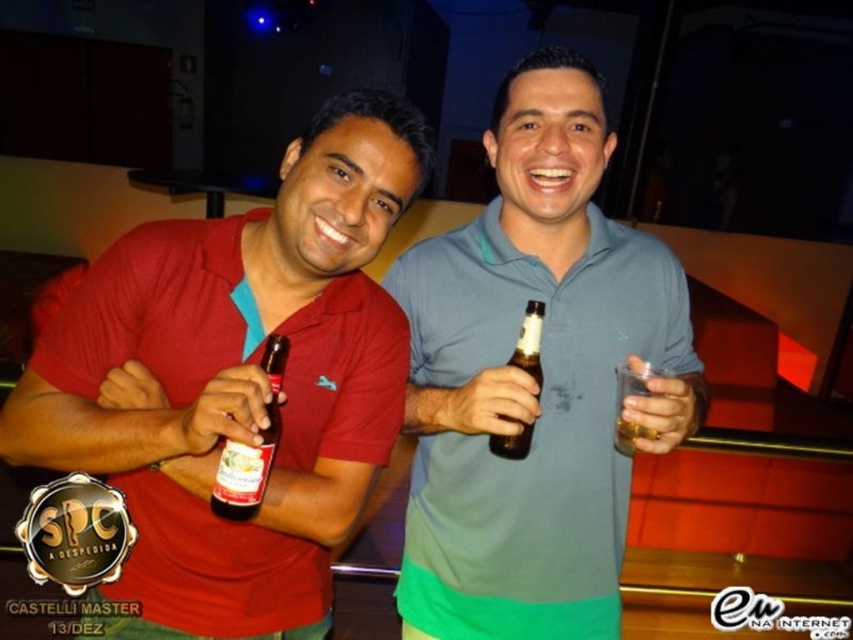
You are standing in the same room as the people in the image. If you want to hand a drink to the matte red shirt at left without moving your feet, in which direction should you turn your body?

Since the matte red shirt at left is located at point (239, 380), you should turn your body to your left to face them.